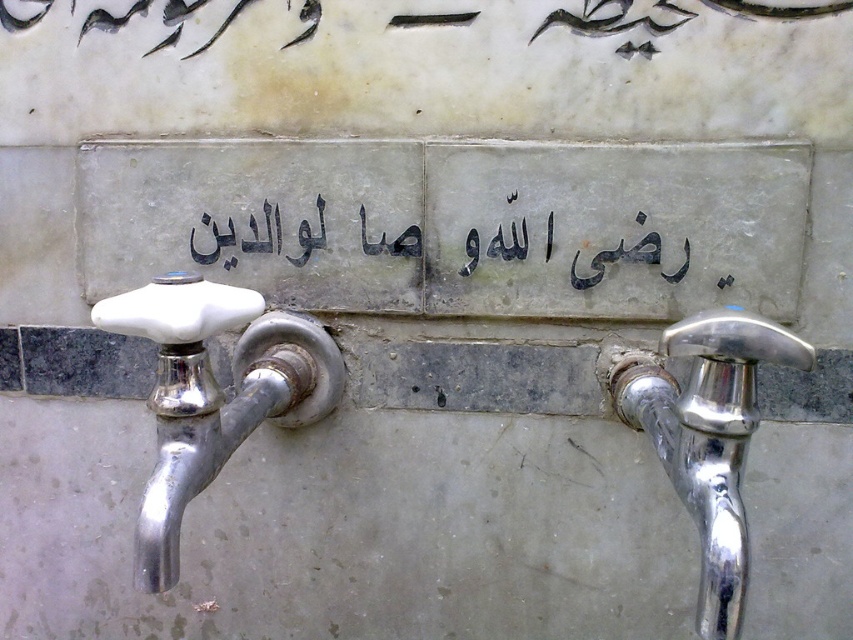
You are standing in front of the wall with the water faucet system. You need to locate the polished chrome faucet at right and the black stone writing at center. Based on their positions, which object is closer to your right side?

The polished chrome faucet at right is to the right of black stone writing at center, so it is closer to your right side.

You are a maintenance worker inspecting the wall mounted water faucet system. You need to adjust the white porcelain faucet at left and the polished chrome faucet at right. According to the system design, which faucet is positioned higher?

The white porcelain faucet at left is located above the polished chrome faucet at right, so it is positioned higher.

You are a maintenance worker needing to replace a part that connects the two faucets. The part requires the distance between the two faucets to be exactly 16.29 inches. Based on the scene, will the part fit correctly between the white porcelain faucet at left and the polished chrome faucet at right?

The white porcelain faucet at left is 16.29 inches from polished chrome faucet at right, so the part will fit correctly between them.